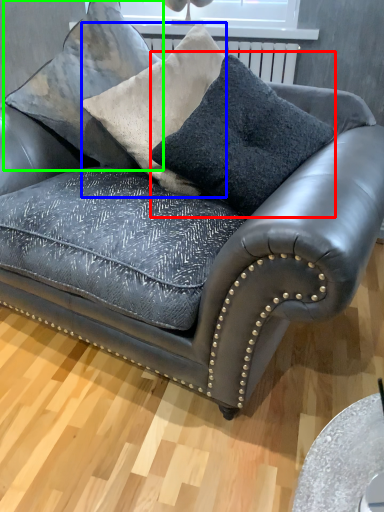
Question: Which object is the closest to the throw pillow (highlighted by a red box)? Choose among these: throw pillow (highlighted by a blue box) or pillow (highlighted by a green box).

Choices:
 (A) throw pillow
 (B) pillow

Answer: (A)